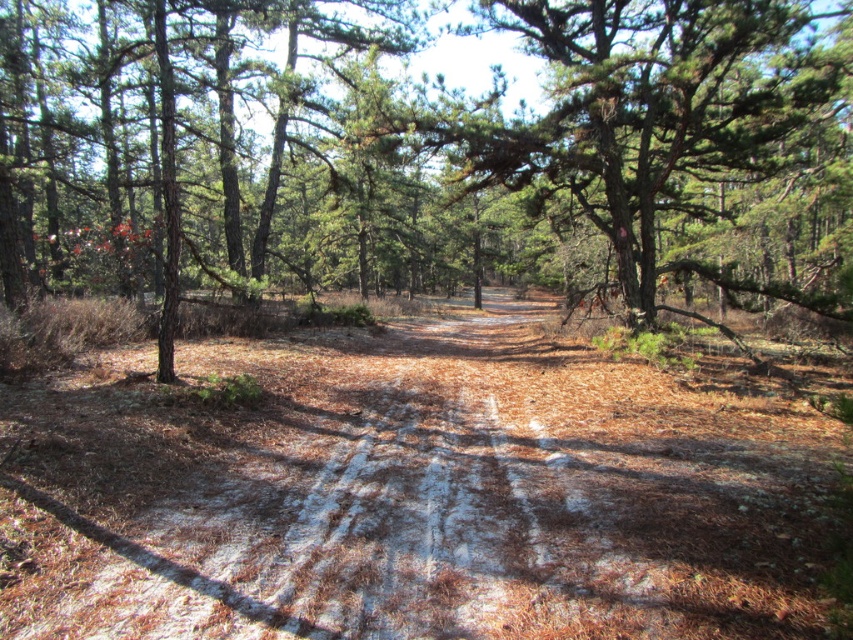
Question: Among these objects, which one is nearest to the camera?

Choices:
 (A) brown dirt track at center
 (B) green rough bark tree at center

Answer: (A)

Question: Is brown dirt track at center to the left of green rough bark tree at center from the viewer's perspective?

Choices:
 (A) yes
 (B) no

Answer: (A)

Question: Which point is farther to the camera?

Choices:
 (A) (392, 538)
 (B) (541, 195)

Answer: (B)

Question: Does brown dirt track at center have a smaller size compared to green rough bark tree at center?

Choices:
 (A) yes
 (B) no

Answer: (A)

Question: Where is brown dirt track at center located in relation to green rough bark tree at center in the image?

Choices:
 (A) above
 (B) below

Answer: (B)